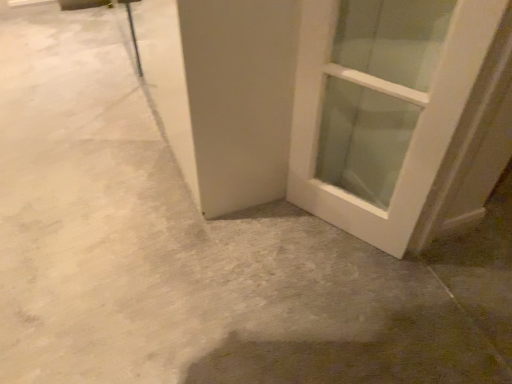
Find the location of `white wooden door at lower right`. white wooden door at lower right is located at coordinates click(x=400, y=115).

The width and height of the screenshot is (512, 384). What do you see at coordinates (400, 115) in the screenshot?
I see `white wooden door at lower right` at bounding box center [400, 115].

This screenshot has height=384, width=512. I want to click on white wooden door at lower right, so click(x=400, y=115).